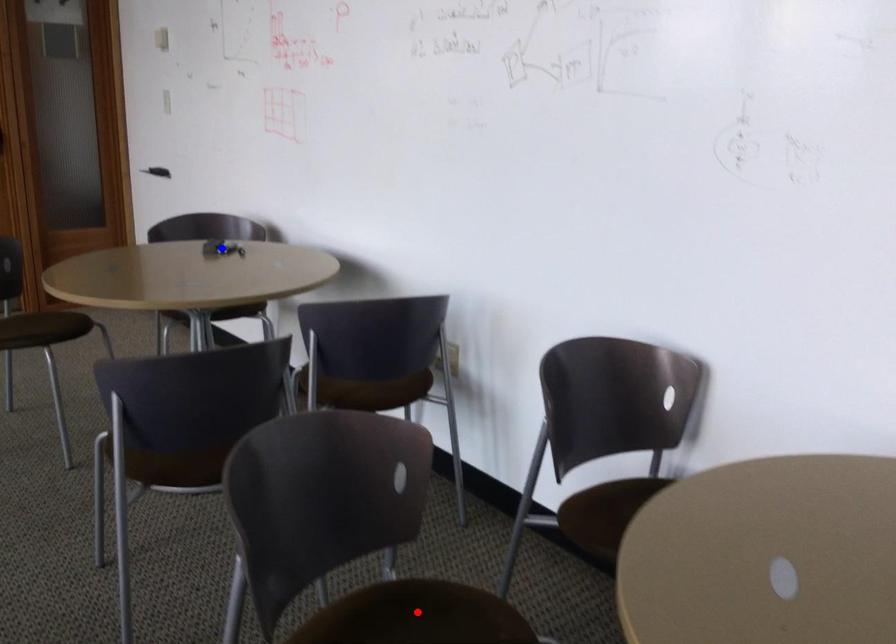
Question: In the image, two points are highlighted. Which point is nearer to the camera? Reply with the corresponding letter.

Choices:
 (A) blue point
 (B) red point

Answer: (B)